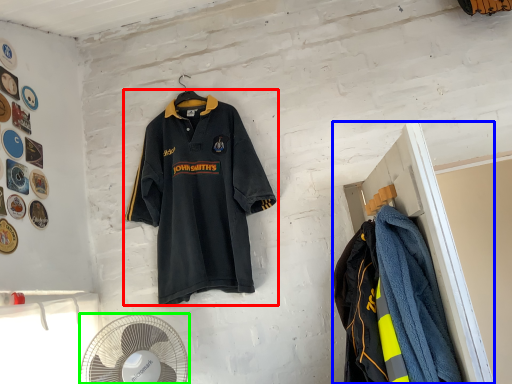
Question: Which is nearer to the sports uniform (highlighted by a red box)? closet (highlighted by a blue box) or mechanical fan (highlighted by a green box).

Choices:
 (A) closet
 (B) mechanical fan

Answer: (B)